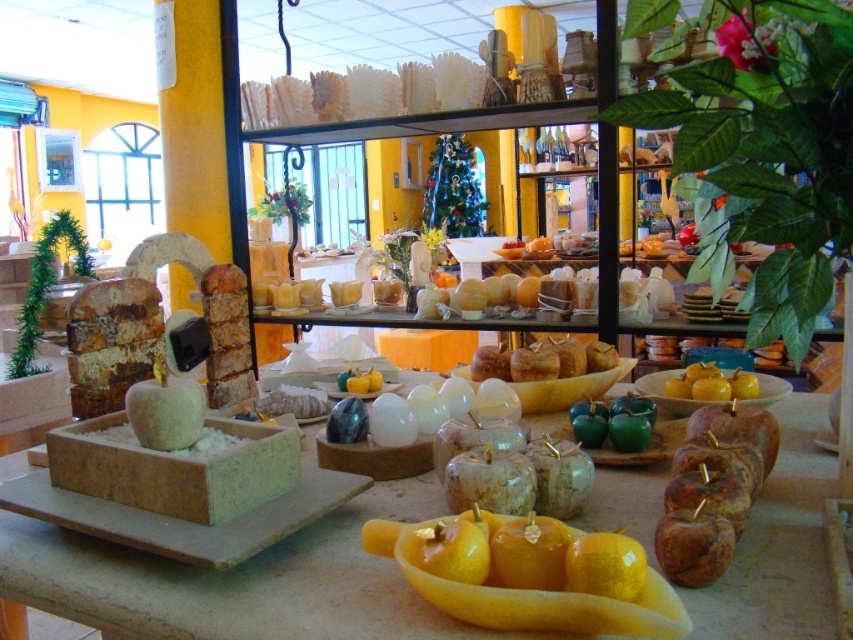
Question: Which point is closer to the camera?

Choices:
 (A) matte stone bowl at center
 (B) yellow wax candle at center
 (C) yellow glossy apples at center

Answer: (B)

Question: Does matte stone bowl at center have a greater width compared to yellow glossy apples at center?

Choices:
 (A) yes
 (B) no

Answer: (A)

Question: Is yellow wax candle at center to the left of yellow glossy apples at center from the viewer's perspective?

Choices:
 (A) yes
 (B) no

Answer: (A)

Question: Among these objects, which one is farthest from the camera?

Choices:
 (A) yellow wax candle at center
 (B) matte stone bowl at center

Answer: (B)

Question: Is yellow wax candle at center in front of yellow glossy apples at center?

Choices:
 (A) no
 (B) yes

Answer: (B)

Question: Which point is closer to the camera?

Choices:
 (A) (781, 556)
 (B) (744, 380)
 (C) (561, 628)

Answer: (C)